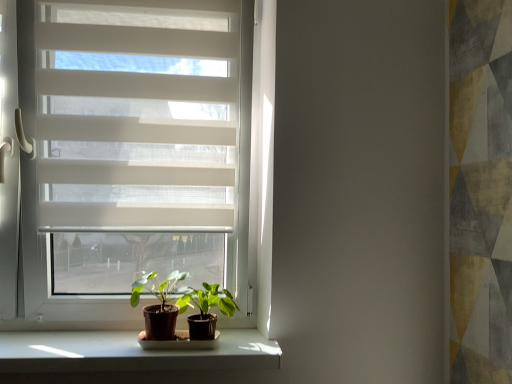
Identify the location of vacant space that is in between white matte window at center and brown matte pot at lower center. The image size is (512, 384). (96, 349).